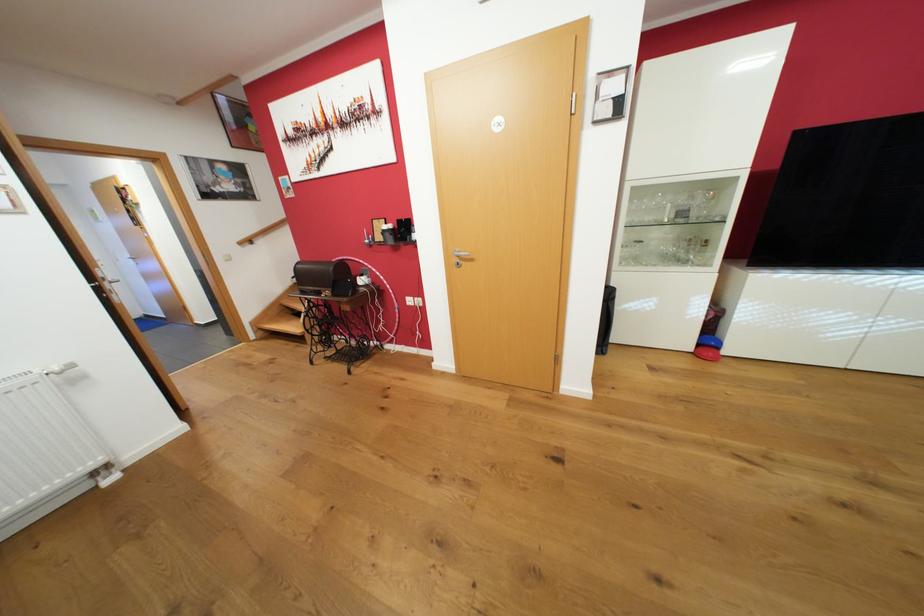
What do you see at coordinates (261, 233) in the screenshot? I see `the wooden handrail` at bounding box center [261, 233].